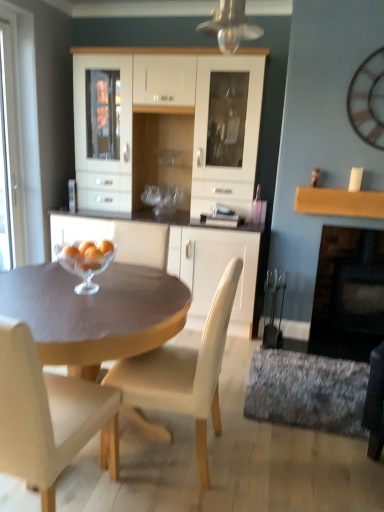
Where is `wooden clock at upper right`? Image resolution: width=384 pixels, height=512 pixels. wooden clock at upper right is located at coordinates (368, 100).

The image size is (384, 512). Describe the element at coordinates (181, 376) in the screenshot. I see `white leather chair at center, the 1th chair when ordered from right to left` at that location.

I want to click on black matte fireplace at right, so click(x=348, y=294).

What is the approximate height of textured gray rug at lower right?

textured gray rug at lower right is 2.43 inches tall.

The height and width of the screenshot is (512, 384). What do you see at coordinates (86, 262) in the screenshot? I see `clear glass bowl at center` at bounding box center [86, 262].

What is the approximate width of matte brown table at center?

matte brown table at center is 3.66 feet wide.

Measure the distance between white glass door at left and camera.

9.95 feet.

Describe the element at coordinates (12, 137) in the screenshot. I see `white glass door at left` at that location.

The height and width of the screenshot is (512, 384). In order to click on wooden clock at upper right in this screenshot , I will do `click(368, 100)`.

Does matte brown table at center have a lesser height compared to clear glass bowl at center?

Incorrect, the height of matte brown table at center does not fall short of that of clear glass bowl at center.

Are matte brown table at center and clear glass bowl at center beside each other?

matte brown table at center and clear glass bowl at center are clearly separated.

Is matte brown table at center facing towards clear glass bowl at center?

No, matte brown table at center is not turned towards clear glass bowl at center.

From a real-world perspective, is matte brown table at center located beneath clear glass bowl at center?

Yes, from a real-world perspective, matte brown table at center is beneath clear glass bowl at center.

How much distance is there between wooden clock at upper right and textured gray rug at lower right?

wooden clock at upper right and textured gray rug at lower right are 1.75 meters apart from each other.

Is wooden clock at upper right situated inside textured gray rug at lower right or outside?

wooden clock at upper right lies outside textured gray rug at lower right.

From a real-world perspective, who is located lower, wooden clock at upper right or textured gray rug at lower right?

textured gray rug at lower right.

Does point (379, 52) lie in front of point (344, 392)?

No, it is not.

Which object is thinner, white glass door at left or clear glass bowl at center?

With smaller width is white glass door at left.

Is white glass door at left placed right next to clear glass bowl at center?

No.

Is white glass door at left turned away from clear glass bowl at center?

That's not correct — white glass door at left is not looking away from clear glass bowl at center.

Between white glass door at left and clear glass bowl at center, which one has less height?

Standing shorter between the two is clear glass bowl at center.

Is point (76, 432) positioned before point (107, 265)?

That is True.

Which chair is the 2nd one when counting from the front of the clear glass bowl at center? Please provide its 2D coordinates.

[(47, 415)]

How far apart are beige leather chair at center, the 1th chair positioned from the left, and clear glass bowl at center?

The distance of beige leather chair at center, the 1th chair positioned from the left, from clear glass bowl at center is 66.74 centimeters.

Between beige leather chair at center, which appears as the 2th chair when viewed from the right, and clear glass bowl at center, which one has smaller size?

clear glass bowl at center is smaller.

Is textured gray rug at lower right with white glass door at left?

No.

From a real-world perspective, is textured gray rug at lower right physically above white glass door at left?

Actually, textured gray rug at lower right is physically below white glass door at left in the real world.

Locate an element on the screen. Image resolution: width=384 pixels, height=512 pixels. gray in front of the white glass door at left is located at coordinates (307, 391).

Is black matte fireplace at right oriented away from white leather chair at center, the 1th chair when ordered from right to left?

No, white leather chair at center, the 1th chair when ordered from right to left, is not at the back of black matte fireplace at right.

From a real-world perspective, who is located lower, black matte fireplace at right or white leather chair at center, the 2th chair viewed from the left?

white leather chair at center, the 2th chair viewed from the left, is physically lower.

Does black matte fireplace at right come in front of white leather chair at center, the 2th chair viewed from the left?

No, it is not.

Would you say black matte fireplace at right contains white leather chair at center, the 1th chair when ordered from right to left?

Actually, white leather chair at center, the 1th chair when ordered from right to left, is outside black matte fireplace at right.

Between white leather chair at center, the 1th chair when ordered from right to left, and textured gray rug at lower right, which one is positioned behind?

textured gray rug at lower right is behind.

Is white leather chair at center, the 1th chair when ordered from right to left, bigger or smaller than textured gray rug at lower right?

In the image, white leather chair at center, the 1th chair when ordered from right to left, appears to be larger than textured gray rug at lower right.

Locate an element on the screen. Image resolution: width=384 pixels, height=512 pixels. gray behind the white leather chair at center, the 2th chair viewed from the left is located at coordinates (307, 391).

Is white leather chair at center, the 1th chair when ordered from right to left, far from textured gray rug at lower right?

No, there isn't a large distance between white leather chair at center, the 1th chair when ordered from right to left, and textured gray rug at lower right.

Find the location of a particular element. wine glass behind the matte brown table at center is located at coordinates (86, 262).

Identify the location of clock that appears on the right of textured gray rug at lower right. This screenshot has width=384, height=512. (368, 100).

Considering their positions, is black matte fireplace at right positioned closer to textured gray rug at lower right than white glass door at left?

black matte fireplace at right lies closer to textured gray rug at lower right than the other object.

Considering their positions, is clear glass bowl at center positioned closer to wooden clock at upper right than textured gray rug at lower right?

textured gray rug at lower right.

Considering their positions, is beige leather chair at center, the 1th chair positioned from the left, positioned closer to clear glass bowl at center than white glass door at left?

beige leather chair at center, the 1th chair positioned from the left.

When comparing their distances from black matte fireplace at right, does matte brown table at center or clear glass bowl at center seem further?

clear glass bowl at center lies further to black matte fireplace at right than the other object.

Considering their positions, is matte brown table at center positioned further to white glass door at left than beige leather chair at center, the 1th chair positioned from the left?

beige leather chair at center, the 1th chair positioned from the left, is positioned further to the anchor white glass door at left.

Which object lies further to the anchor point wooden clock at upper right, white leather chair at center, the 2th chair viewed from the left, or white glass door at left?

white glass door at left is further to wooden clock at upper right.

Estimate the real-world distances between objects in this image. Which object is further from matte brown table at center, clear glass bowl at center or wooden clock at upper right?

Based on the image, wooden clock at upper right appears to be further to matte brown table at center.

Which object lies further to the anchor point white glass door at left, matte brown table at center or textured gray rug at lower right?

Among the two, textured gray rug at lower right is located further to white glass door at left.

Locate an element on the screen. The image size is (384, 512). desk situated between white glass door at left and black matte fireplace at right from left to right is located at coordinates (95, 312).

This screenshot has height=512, width=384. Find the location of `wine glass between matte brown table at center and black matte fireplace at right from left to right`. wine glass between matte brown table at center and black matte fireplace at right from left to right is located at coordinates (86, 262).

You are a GUI agent. You are given a task and a screenshot of the screen. Output one action in this format:
    pyautogui.click(x=<x>, y=<y>)
    Task: Click on the desk positioned between beige leather chair at center, which appears as the 2th chair when viewed from the right, and clear glass bowl at center from near to far
    The height and width of the screenshot is (512, 384).
    Given the screenshot: What is the action you would take?
    [x=95, y=312]

Identify the location of chair between clear glass bowl at center and textured gray rug at lower right from left to right. The height and width of the screenshot is (512, 384). (181, 376).